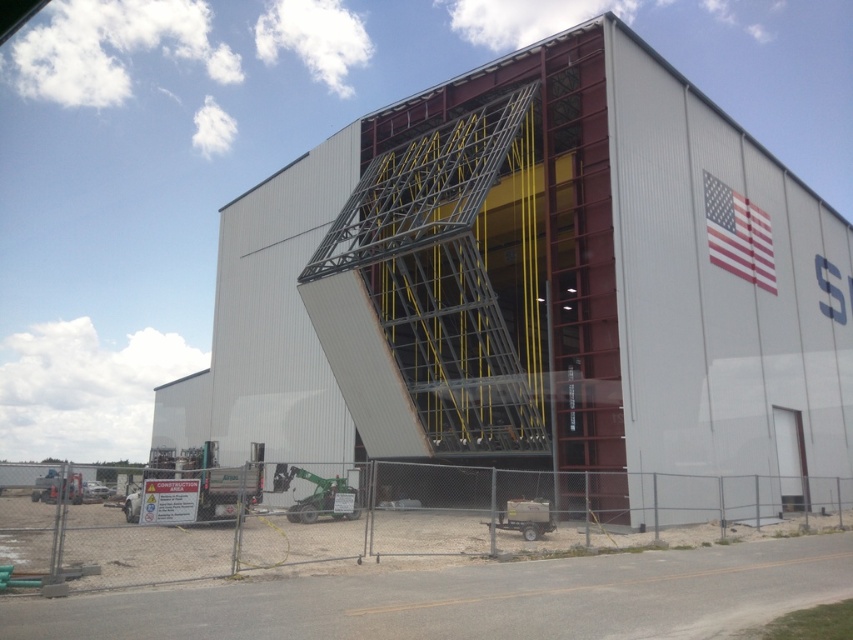
Consider the image. You are standing in front of the industrial building and want to take a photo. There are two points marked on the building, point (804,412) and point (477,572). Which point will appear closer to the camera in your photo?

Point (477,572) will appear closer to the camera in the photo because it is closer to the viewer than point (804,412).

You are a delivery truck driver arriving at the construction site. You see the metal fence at lower center and the american flag at upper right. Which object is closer to the ground?

The metal fence at lower center is located below the american flag at upper right, so it is closer to the ground.

You are standing at the entrance of the building and want to locate the metallic gray hangar at center. According to the coordinates provided, where should you look relative to your current position?

The metallic gray hangar at center is located at coordinates point (532,292), which means it is positioned to the right and slightly below your current position at the entrance.